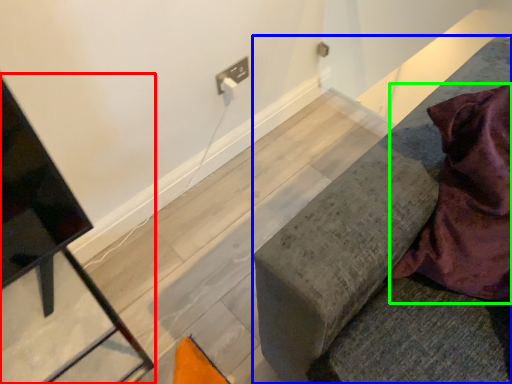
Question: Based on their relative distances, which object is farther from furniture (highlighted by a red box)? Choose from furniture (highlighted by a blue box) and blanket (highlighted by a green box).

Choices:
 (A) furniture
 (B) blanket

Answer: (B)